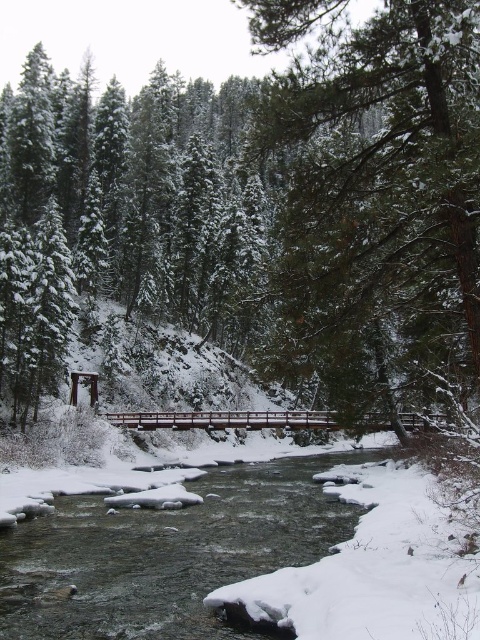
What do you see at coordinates (380, 195) in the screenshot? The image size is (480, 640). I see `green textured tree at center` at bounding box center [380, 195].

I want to click on green textured tree at center, so click(x=380, y=195).